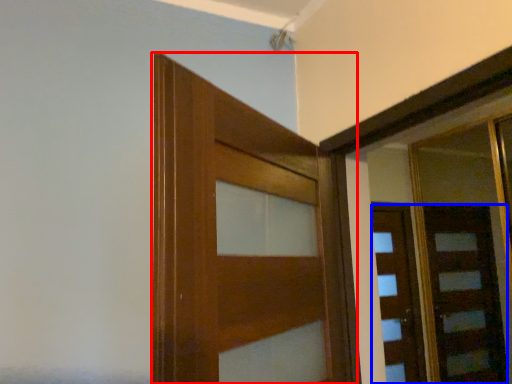
Question: Which point is further to the camera, door (highlighted by a red box) or door (highlighted by a blue box)?

Choices:
 (A) door
 (B) door

Answer: (B)